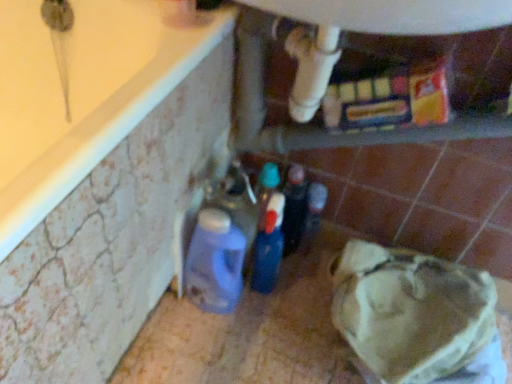
Question: Is matte plastic detergent at lower left, arranged as the 2th bottle when viewed from the right, inside the boundaries of translucent plastic bottle at center, the 1th bottle viewed from the right, or outside?

Choices:
 (A) inside
 (B) outside

Answer: (B)

Question: In terms of width, does matte plastic detergent at lower left, arranged as the 2th bottle when viewed from the right, look wider or thinner when compared to translucent plastic bottle at center, the 1th bottle viewed from the right?

Choices:
 (A) thin
 (B) wide

Answer: (B)

Question: Which is farther from the white plastic water heater at upper center?

Choices:
 (A) matte plastic detergent at lower left, arranged as the 2th bottle when viewed from the right
 (B) translucent plastic bottle at center, the 1th bottle viewed from the right

Answer: (A)

Question: Which object is the closest to the translucent plastic bottle at center, positioned as the second bottle in left-to-right order?

Choices:
 (A) white plastic water heater at upper center
 (B) matte plastic detergent at lower left, arranged as the 2th bottle when viewed from the right

Answer: (B)